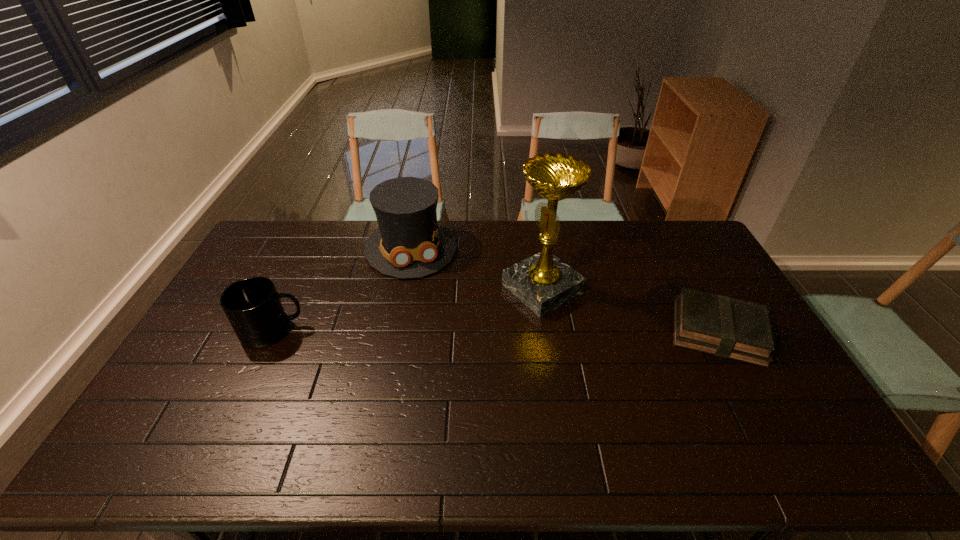
You are a GUI agent. You are given a task and a screenshot of the screen. Output one action in this format:
    pyautogui.click(x=<x>, y=<y>)
    Task: Click on the leftmost object
    
    Given the screenshot: What is the action you would take?
    pyautogui.click(x=253, y=307)

Where is `mug`? This screenshot has height=540, width=960. mug is located at coordinates (253, 307).

Image resolution: width=960 pixels, height=540 pixels. I want to click on book, so click(x=719, y=325).

You are a GUI agent. You are given a task and a screenshot of the screen. Output one action in this format:
    pyautogui.click(x=<x>, y=<y>)
    Task: Click on the shortest object
    This screenshot has width=960, height=540.
    Given the screenshot: What is the action you would take?
    pyautogui.click(x=719, y=325)

Where is `dress hat`? The height and width of the screenshot is (540, 960). dress hat is located at coordinates (409, 243).

This screenshot has height=540, width=960. Identify the location of the second object from left to right. (409, 243).

Where is `the tallest object`? the tallest object is located at coordinates (543, 282).

You are a GUI agent. You are given a task and a screenshot of the screen. Output one action in this format:
    pyautogui.click(x=<x>, y=<y>)
    Task: Click on the award
    This screenshot has width=960, height=540.
    Given the screenshot: What is the action you would take?
    pyautogui.click(x=543, y=282)

This screenshot has width=960, height=540. Identify the location of free space located with the handle on the side of the leftmost object. (372, 331).

I want to click on free space located on the front of the rightmost object, so pyautogui.click(x=763, y=416).